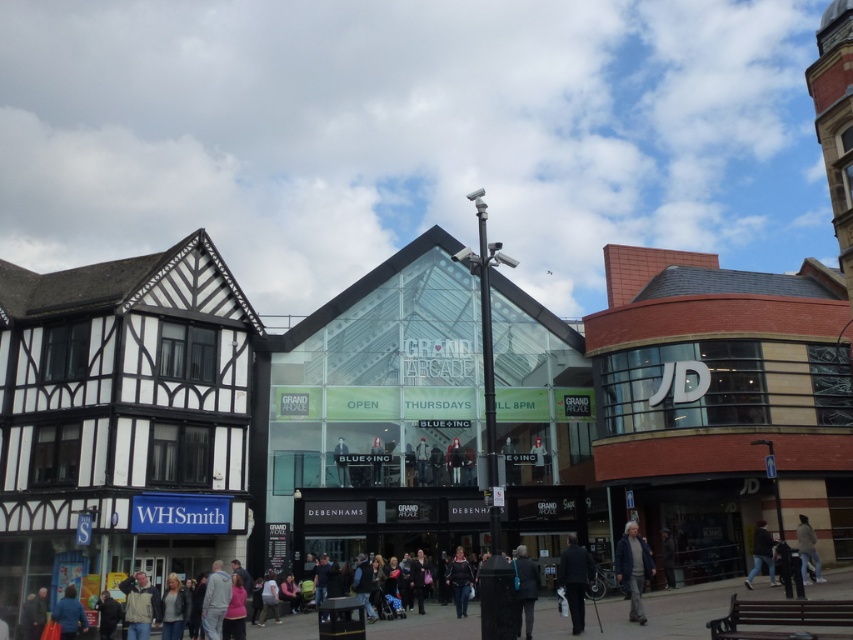
You are a customer in the Grand Arcade shopping center and you want to try on two jackets displayed at the lower right corner. Which jacket is taller between the blue denim jacket at lower right and the dark brown leather jacket at lower right?

The blue denim jacket at lower right is much taller than the dark brown leather jacket at lower right.

You are a customer at the GRAND ARCADE and see the dark blue fabric jacket at lower center and the dark gray sweater at center. Which clothing item is placed higher in the store display?

The dark blue fabric jacket at lower center is positioned over the dark gray sweater at center, so it is placed higher in the store display.

You are standing at the center of the pedestrian area and want to find the blue denim jacket at lower right. According to the scene, in which direction should you move to locate it?

The blue denim jacket at lower right is located at point (633, 568), which corresponds to the lower right area of the image. To reach it, you should move towards the right and downward from your current position at the center.